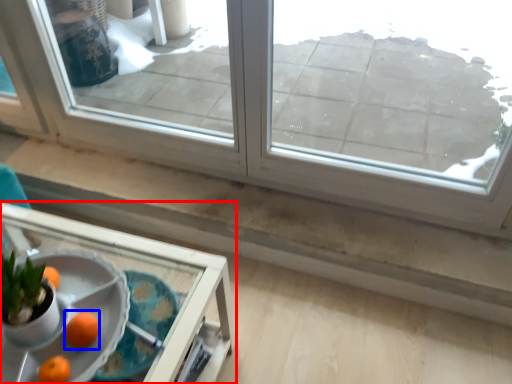
Question: Among these objects, which one is farthest to the camera, table (highlighted by a red box) or orange (highlighted by a blue box)?

Choices:
 (A) table
 (B) orange

Answer: (B)